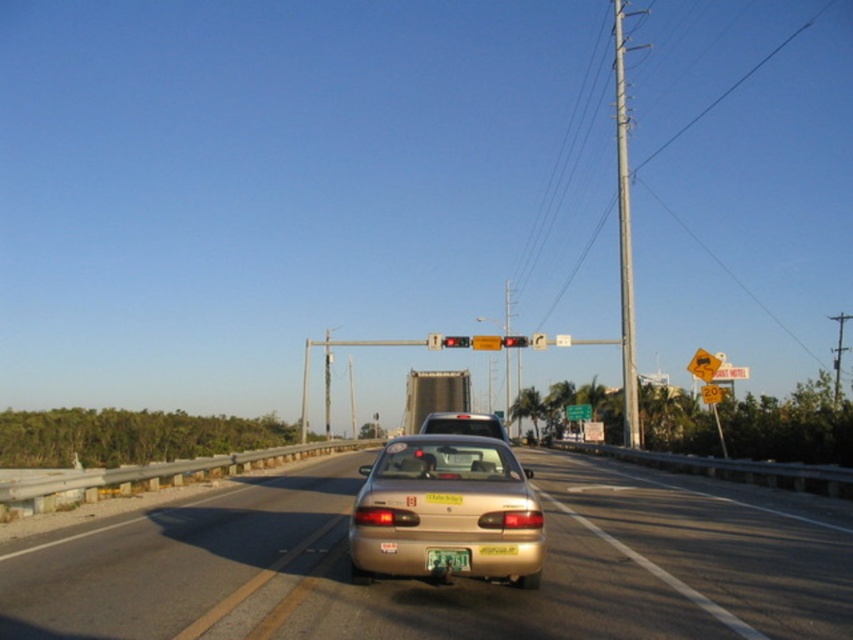
Based on the photo, is gold matte sedan at center closer to camera compared to green reflective sign at center?

Yes.

Is gold matte sedan at center further to camera compared to green reflective sign at center?

That is False.

This screenshot has width=853, height=640. What do you see at coordinates (445, 509) in the screenshot?
I see `gold matte sedan at center` at bounding box center [445, 509].

Locate an element on the screen. This screenshot has height=640, width=853. gold matte sedan at center is located at coordinates (445, 509).

Which is above, silver metallic pole at right or gold metallic sedan at center?

silver metallic pole at right is higher up.

Identify the location of silver metallic pole at right. (624, 234).

At what (x,y) coordinates should I click in order to perform the action: click on silver metallic pole at right. Please return your answer as a coordinate pair (x, y). The image size is (853, 640). Looking at the image, I should click on (624, 234).

The height and width of the screenshot is (640, 853). What are the coordinates of `silver metallic pole at right` in the screenshot? It's located at (624, 234).

Does yellow plastic sign at center appear on the right side of green reflective sign at center?

No, yellow plastic sign at center is not to the right of green reflective sign at center.

Image resolution: width=853 pixels, height=640 pixels. What do you see at coordinates (486, 342) in the screenshot?
I see `yellow plastic sign at center` at bounding box center [486, 342].

In order to click on yellow plastic sign at center in this screenshot , I will do `click(486, 342)`.